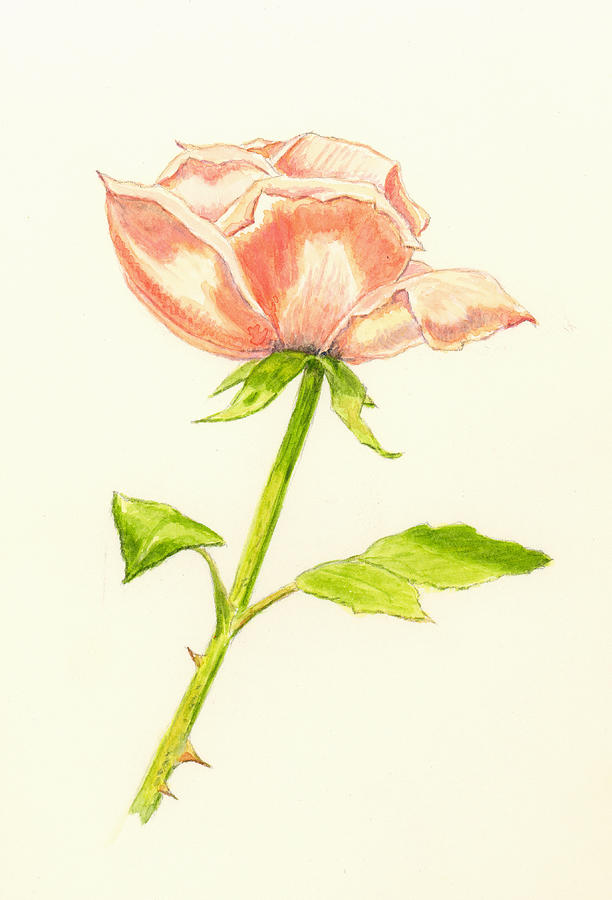
Where is `corner`? corner is located at coordinates (568, 878).